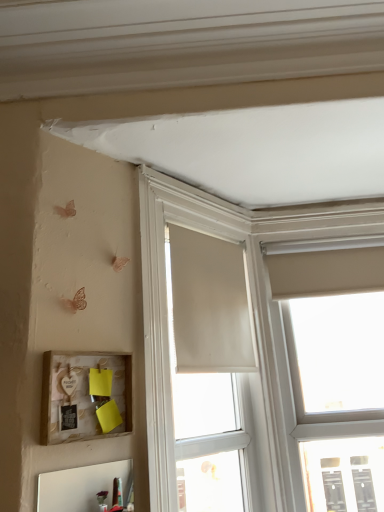
Question: Is matte white window at upper right, positioned as the 1th window in right-to-left order, a part of matte white window at center, the second window when ordered from right to left?

Choices:
 (A) yes
 (B) no

Answer: (B)

Question: Can you confirm if matte white window at center, the second window when ordered from right to left, is positioned to the left of matte white window at upper right, the 2th window in the left-to-right sequence?

Choices:
 (A) no
 (B) yes

Answer: (B)

Question: Considering the relative sizes of matte white window at center, the second window when ordered from right to left, and matte white window at upper right, the 2th window in the left-to-right sequence, in the image provided, is matte white window at center, the second window when ordered from right to left, thinner than matte white window at upper right, the 2th window in the left-to-right sequence,?

Choices:
 (A) yes
 (B) no

Answer: (B)

Question: From a real-world perspective, is matte white window at center, which ranks as the 1th window in left-to-right order, over matte white window at upper right, positioned as the 1th window in right-to-left order?

Choices:
 (A) no
 (B) yes

Answer: (B)

Question: Is matte white window at center, the second window when ordered from right to left, facing towards matte white window at upper right, positioned as the 1th window in right-to-left order?

Choices:
 (A) yes
 (B) no

Answer: (B)

Question: Are matte white window at center, which ranks as the 1th window in left-to-right order, and matte white window at upper right, the 2th window in the left-to-right sequence, far apart?

Choices:
 (A) yes
 (B) no

Answer: (B)

Question: From a real-world perspective, is wooden picture frame at lower left physically below beige fabric curtain at center?

Choices:
 (A) yes
 (B) no

Answer: (A)

Question: From a real-world perspective, does wooden picture frame at lower left stand above beige fabric curtain at center?

Choices:
 (A) yes
 (B) no

Answer: (B)

Question: Is wooden picture frame at lower left next to beige fabric curtain at center and touching it?

Choices:
 (A) yes
 (B) no

Answer: (B)

Question: Does wooden picture frame at lower left appear on the left side of beige fabric curtain at center?

Choices:
 (A) yes
 (B) no

Answer: (A)

Question: Is the position of wooden picture frame at lower left less distant than that of beige fabric curtain at center?

Choices:
 (A) no
 (B) yes

Answer: (B)

Question: Does wooden picture frame at lower left have a greater width compared to beige fabric curtain at center?

Choices:
 (A) yes
 (B) no

Answer: (A)

Question: Is matte white window at center, which ranks as the 1th window in left-to-right order, located within matte white window at upper right, the 2th window in the left-to-right sequence?

Choices:
 (A) no
 (B) yes

Answer: (A)